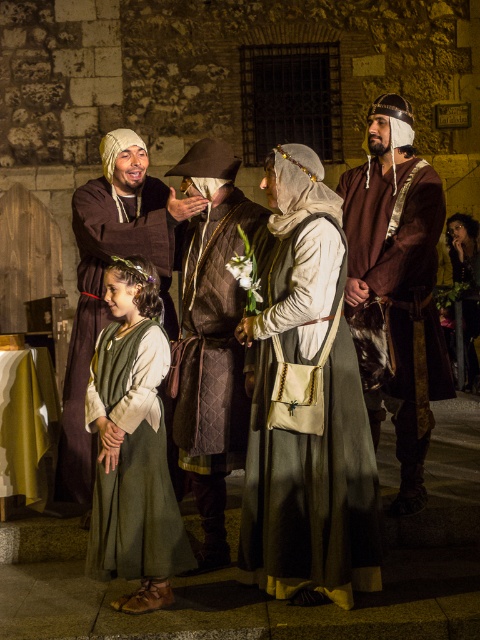
Question: Can you confirm if brown quilted tunic at center is thinner than brown leather hat at center?

Choices:
 (A) yes
 (B) no

Answer: (A)

Question: Which object is positioned farthest from the brown leather armor at right?

Choices:
 (A) brown leather hat at center
 (B) green fabric dress at center
 (C) matte gray robe at center

Answer: (B)

Question: Which object is farther from the camera taking this photo?

Choices:
 (A) brown leather hat at center
 (B) brown quilted tunic at center
 (C) matte gray robe at center
 (D) green fabric dress at center

Answer: (A)

Question: Which is farther from the brown leather hat at center?

Choices:
 (A) brown leather armor at right
 (B) matte gray robe at center
 (C) green fabric dress at center
 (D) brown quilted tunic at center

Answer: (A)

Question: Can you confirm if brown leather armor at right is wider than brown quilted tunic at center?

Choices:
 (A) no
 (B) yes

Answer: (B)

Question: Can you confirm if brown leather armor at right is positioned to the right of brown leather hat at center?

Choices:
 (A) yes
 (B) no

Answer: (A)